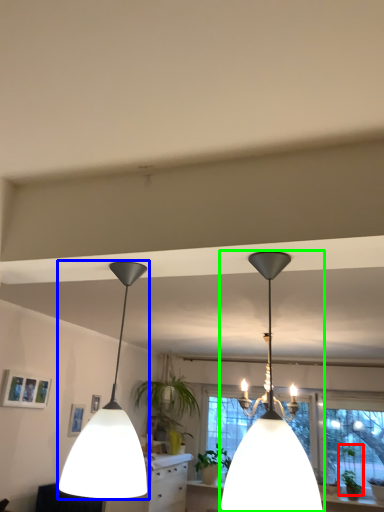
Question: Which object is the farthest from plant (highlighted by a red box)? Choose among these: lamp (highlighted by a blue box) or lamp (highlighted by a green box).

Choices:
 (A) lamp
 (B) lamp

Answer: (A)